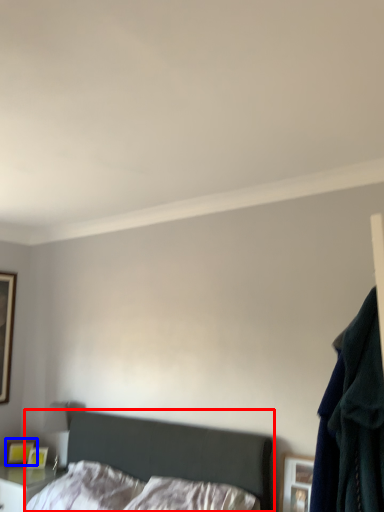
Question: Which point is further to the camera, bed (highlighted by a red box) or picture frame (highlighted by a blue box)?

Choices:
 (A) bed
 (B) picture frame

Answer: (B)